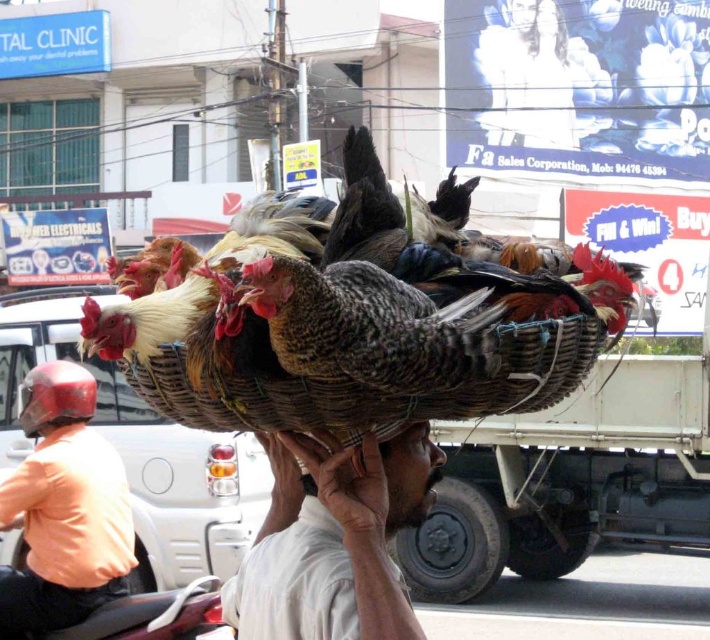
Question: Does white woven basket at center appear on the right side of orange fabric helmet at upper left?

Choices:
 (A) no
 (B) yes

Answer: (B)

Question: Which object is farther from the camera taking this photo?

Choices:
 (A) orange fabric helmet at upper left
 (B) woven bamboo basket at center

Answer: (A)

Question: Can you confirm if orange fabric helmet at upper left is bigger than speckled feathered chicken at center?

Choices:
 (A) yes
 (B) no

Answer: (A)

Question: In this image, where is speckled wicker basket at center located relative to white woven basket at center?

Choices:
 (A) below
 (B) above

Answer: (B)

Question: Which of the following is the farthest from the observer?

Choices:
 (A) (327, 326)
 (B) (87, 396)
 (C) (344, 372)
 (D) (302, 618)

Answer: (B)

Question: Estimate the real-world distances between objects in this image. Which object is closer to the speckled wicker basket at center?

Choices:
 (A) brown woven basket at center
 (B) woven bamboo basket at center
 (C) white woven basket at center
 (D) speckled feathered chicken at center

Answer: (B)